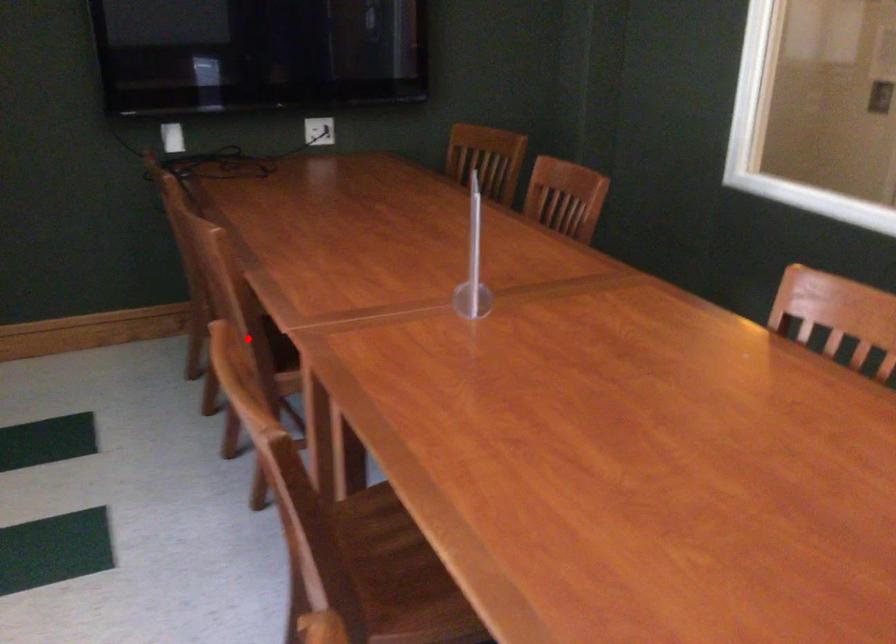
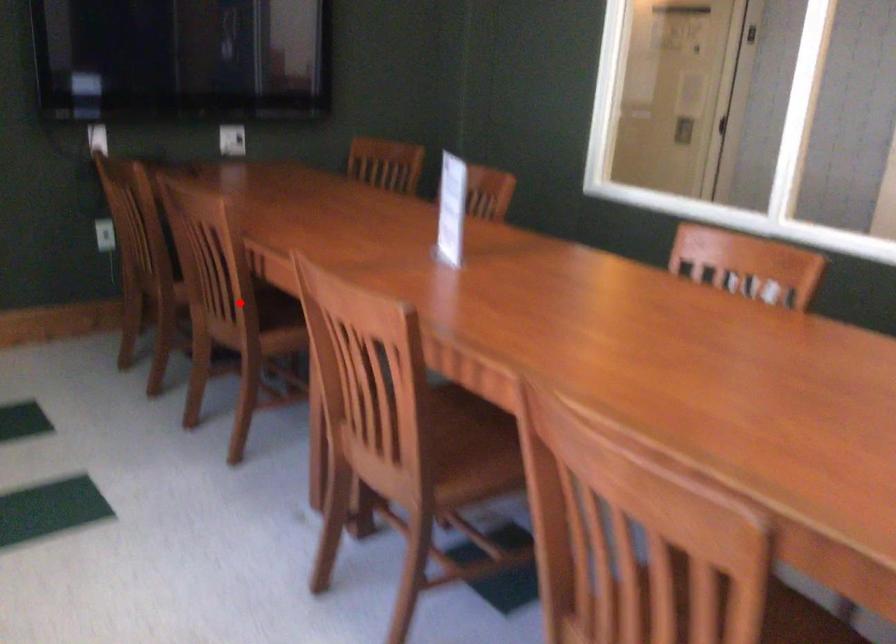
I am providing you with two images of the same scene from different viewpoints. A red point is marked on the first image and another point is marked on the second image. Do the highlighted points in image1 and image2 indicate the same real-world spot?

Yes